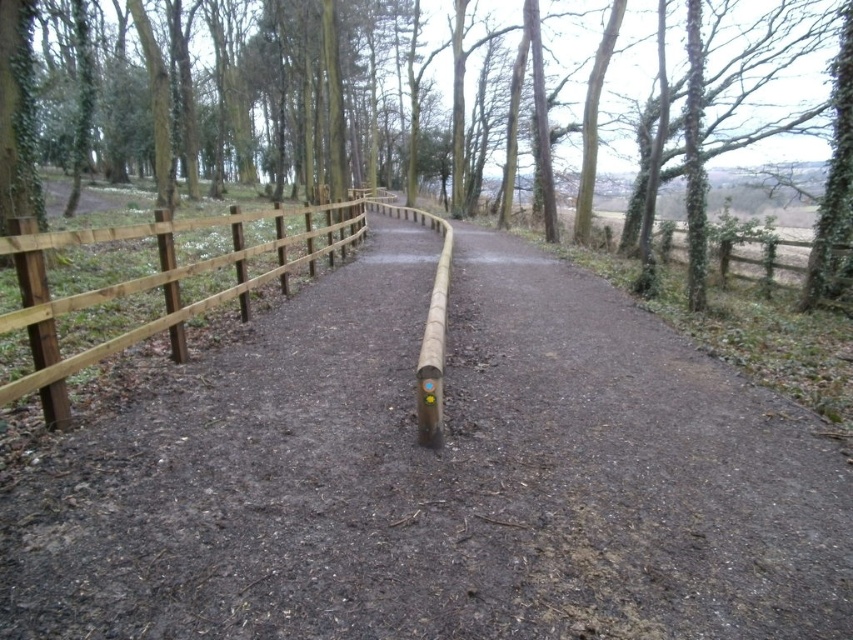
Question: Does brown dirt path at center come in front of brown wooden fence at center?

Choices:
 (A) yes
 (B) no

Answer: (A)

Question: Is brown wooden path at center further to camera compared to natural wood fence at left?

Choices:
 (A) no
 (B) yes

Answer: (A)

Question: Which object appears closest to the camera in this image?

Choices:
 (A) brown dirt path at center
 (B) brown wooden path at center

Answer: (A)

Question: Which object appears closest to the camera in this image?

Choices:
 (A) natural wood fence at left
 (B) brown wooden fence at center

Answer: (B)

Question: Estimate the real-world distances between objects in this image. Which object is closer to the brown wooden path at center?

Choices:
 (A) brown wooden fence at center
 (B) brown dirt path at center

Answer: (B)

Question: Where is brown dirt path at center located in relation to brown wooden fence at center in the image?

Choices:
 (A) left
 (B) right

Answer: (B)